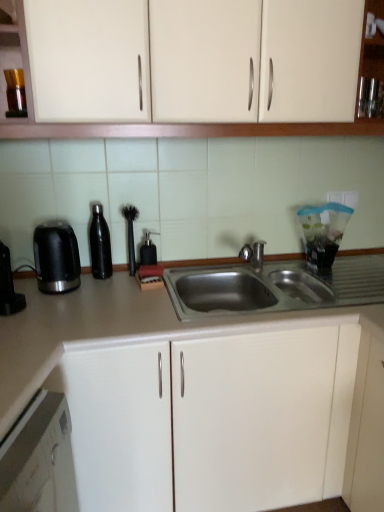
Where is `blank area to the left of black plastic kettle at left`? The image size is (384, 512). blank area to the left of black plastic kettle at left is located at coordinates (25, 288).